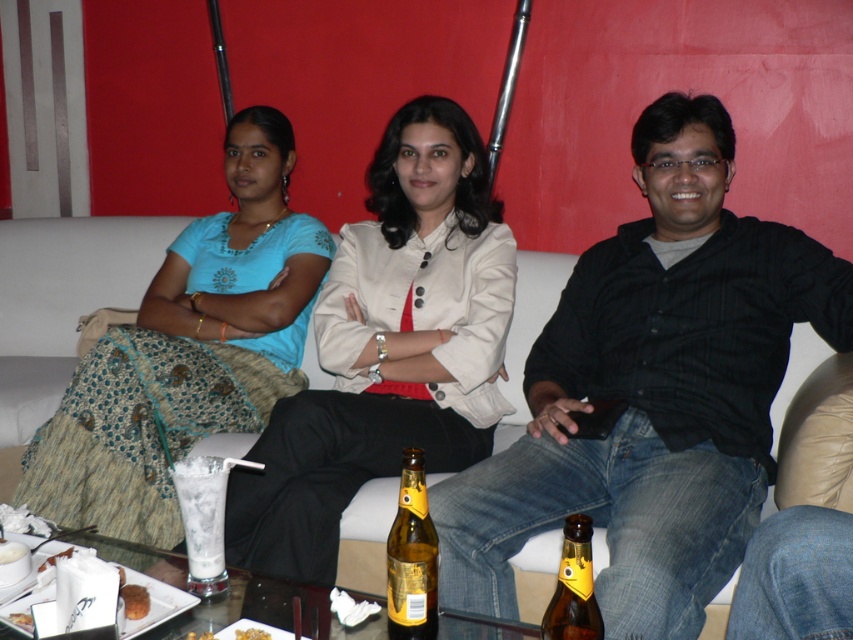
Question: Does black cotton shirt at center have a smaller size compared to matte blue blouse at center?

Choices:
 (A) no
 (B) yes

Answer: (A)

Question: Does black cotton shirt at center appear on the right side of matte blue blouse at center?

Choices:
 (A) yes
 (B) no

Answer: (A)

Question: Which point appears closest to the camera in this image?

Choices:
 (A) (664, 499)
 (B) (323, 256)
 (C) (578, 627)
 (D) (215, 440)

Answer: (C)

Question: Which object is positioned closest to the matte blue blouse at center?

Choices:
 (A) white fabric couch at center
 (B) gold glass bottle at center
 (C) brown glass bottle at center

Answer: (A)

Question: Can you confirm if matte blue blouse at center is thinner than brown glass bottle at center?

Choices:
 (A) no
 (B) yes

Answer: (A)

Question: Which object is the farthest from the matte blue blouse at center?

Choices:
 (A) black cotton shirt at center
 (B) brown glass bottle at center

Answer: (B)